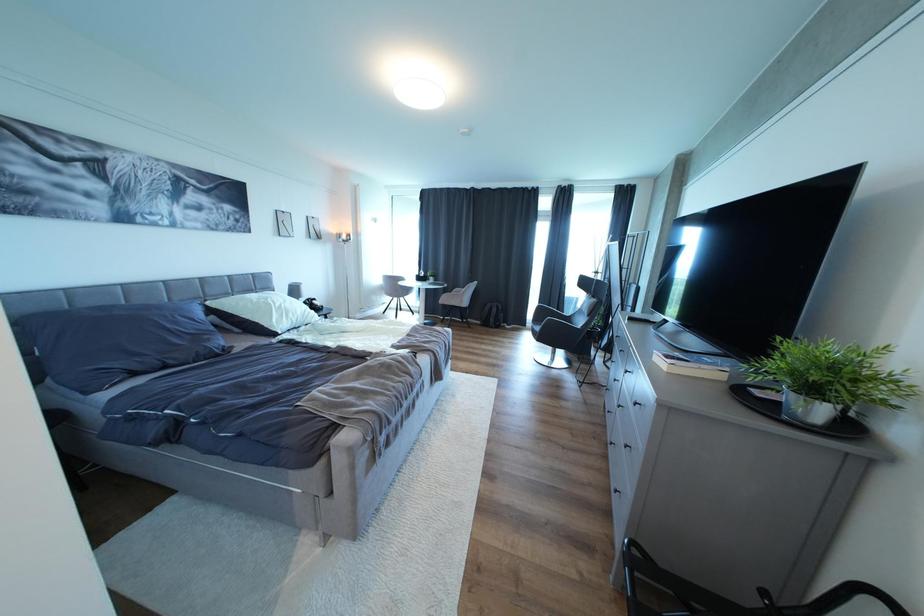
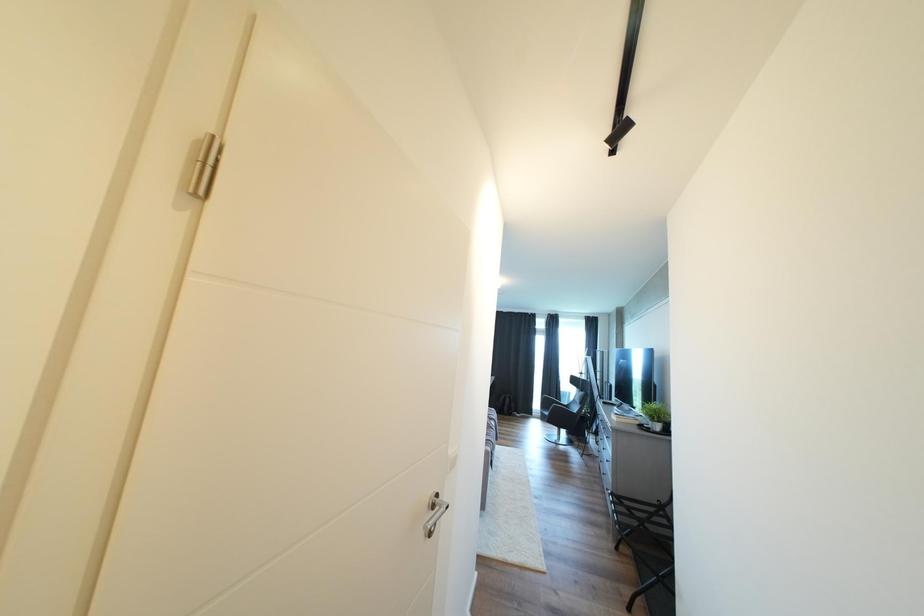
The images are taken continuously from a first-person perspective. In which direction are you moving?

The movement direction of the cameraman is left, backward.